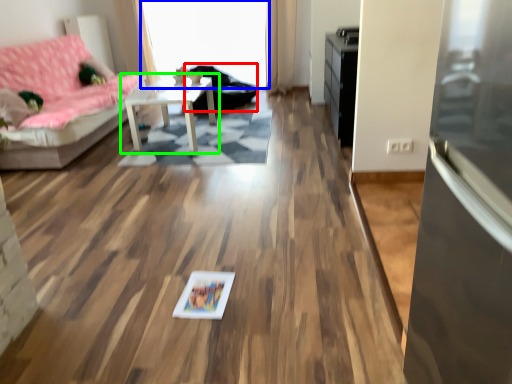
Question: Which object is the closest to the armchair (highlighted by a red box)? Choose among these: window screen (highlighted by a blue box) or table (highlighted by a green box).

Choices:
 (A) window screen
 (B) table

Answer: (A)